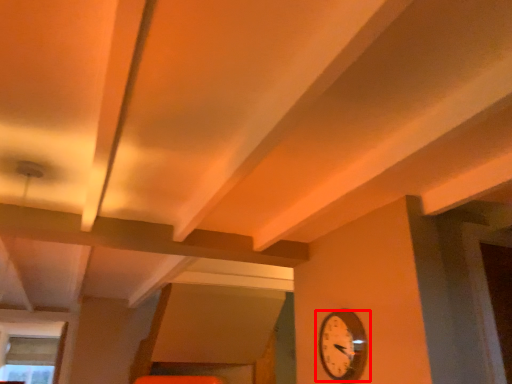
Question: From the image's perspective, where is wall clock (annotated by the red box) located in relation to window in the image?

Choices:
 (A) above
 (B) below

Answer: (A)